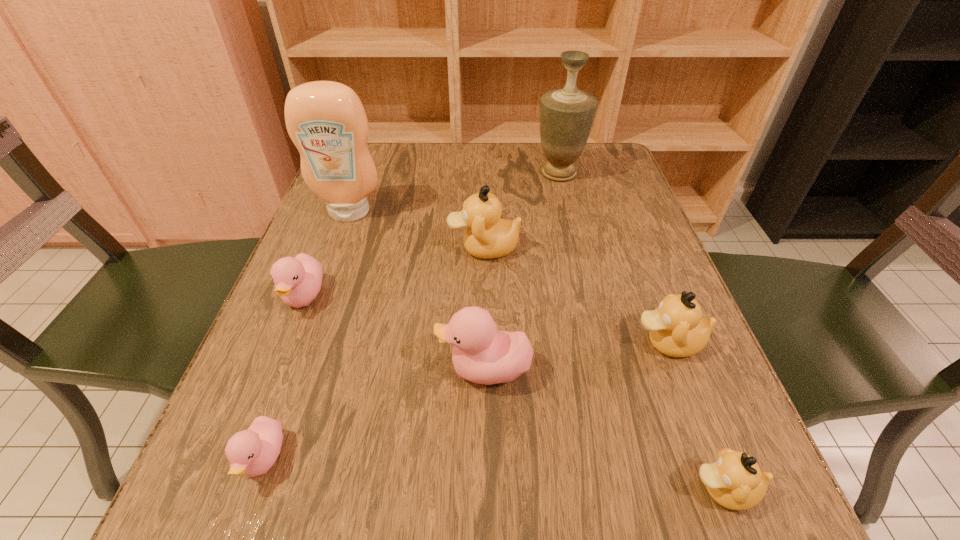
Locate an element on the screen. This screenshot has width=960, height=540. vacant region located on the face of the second smallest tan duckling is located at coordinates (438, 343).

Locate an element on the screen. free space located 0.130m on the face of the second smallest tan duckling is located at coordinates (556, 343).

Find the location of `free space located 0.400m on the face of the second smallest tan duckling`. free space located 0.400m on the face of the second smallest tan duckling is located at coordinates (396, 343).

Locate an element on the screen. The image size is (960, 540). vacant area situated on the front-facing side of the farthest pink duckling is located at coordinates (284, 349).

At what (x,y) coordinates should I click in order to perform the action: click on free space located on the face of the nearest tan duckling. Please return your answer as a coordinate pair (x, y). Image resolution: width=960 pixels, height=540 pixels. Looking at the image, I should click on (651, 490).

Locate an element on the screen. This screenshot has width=960, height=540. vacant space located on the face of the nearest tan duckling is located at coordinates (428, 490).

You are a GUI agent. You are given a task and a screenshot of the screen. Output one action in this format:
    pyautogui.click(x=<x>, y=<y>)
    Task: Click on the free region located on the face of the nearest tan duckling
    
    Given the screenshot: What is the action you would take?
    pyautogui.click(x=582, y=490)

Locate an element on the screen. object located in the far edge section of the desktop is located at coordinates (566, 115).

At what (x,y) coordinates should I click in order to perform the action: click on condiment located at the left edge. Please return your answer as a coordinate pair (x, y). Image resolution: width=960 pixels, height=540 pixels. Looking at the image, I should click on (326, 120).

Locate an element on the screen. This screenshot has height=540, width=960. urn present at the right edge is located at coordinates (566, 115).